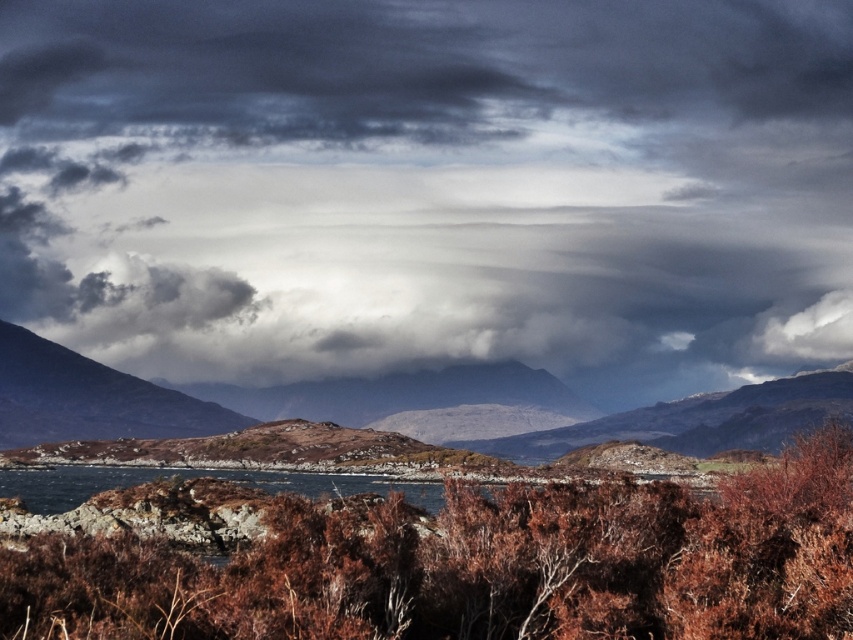
You are an environmental scientist studying the landscape. You observe the brown shrubbery at center and the rugged brown mountain at left. Which object appears taller in the scene?

The rugged brown mountain at left appears taller than the brown shrubbery at center.

You are an adventurer trying to navigate through the mountains. You see a brown rocky mountain at center and a rugged brown mountain at left. Which mountain is located to the right of the other?

The brown rocky mountain at center is positioned on the right side of rugged brown mountain at left, so the brown rocky mountain at center is to the right of the rugged brown mountain at left.

You are a hiker planning to take a photo of the rugged brown mountain at left and the brown rocky mountain at center. Which mountain should you position lower in your camera frame to include both in the shot?

You should position the rugged brown mountain at left lower in your camera frame because the brown rocky mountain at center is located above it.